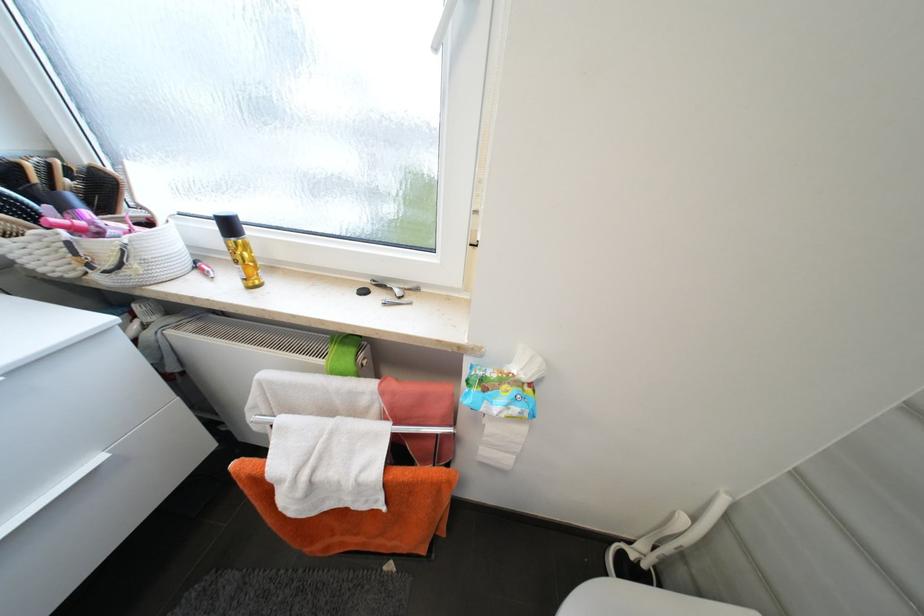
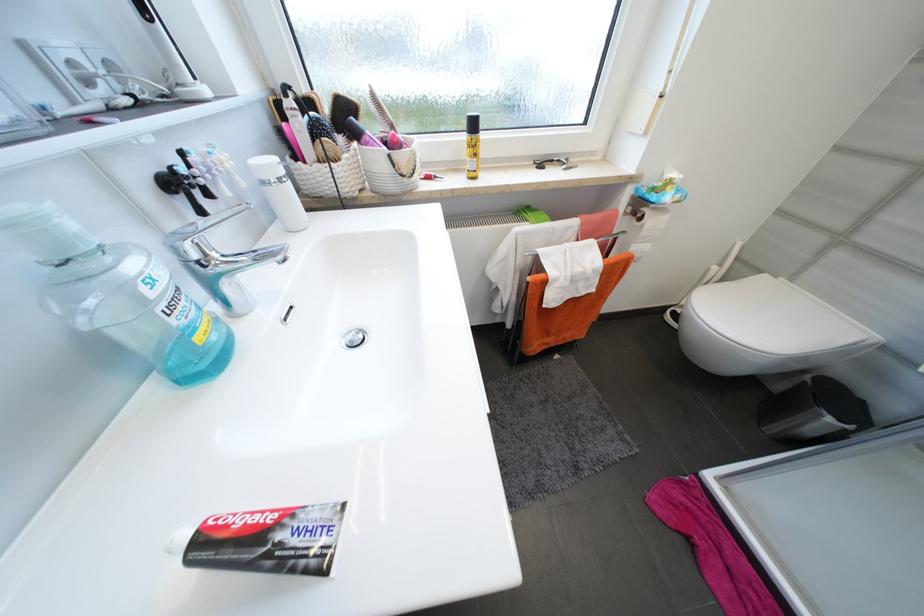
Question: The images are taken continuously from a first-person perspective. In which direction is your viewpoint rotating?

Choices:
 (A) Left
 (B) Right
 (C) Up
 (D) Down

Answer: (D)